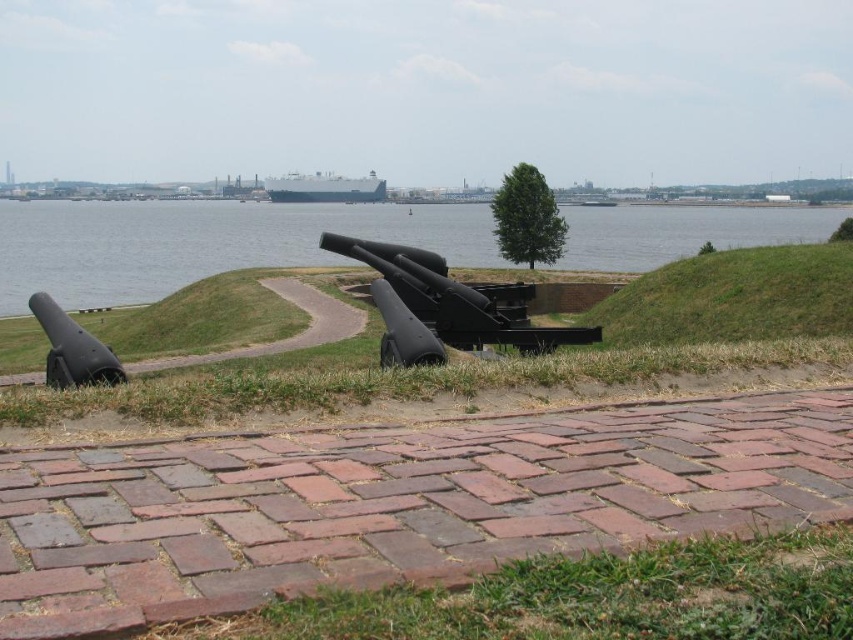
You are a tour guide explaining the layout of the cannons to visitors. You mention the black matte cannon at center and the matte black cannon at left. Which cannon is positioned closer to the brick pathway leading up to them?

The black matte cannon at center is closer to the brick pathway leading up to them because the matte black cannon at left is positioned behind it.

You are a tourist standing at the base of the embankment looking up at the cannons and the water. Which object is closer to you, the blue water at center or the matte black cannon at left?

The matte black cannon at left is closer to you than the blue water at center because the blue water at center is further away in the scene.

You are a historian examining the cannons at the fort. You need to determine which cannon is taller between the black matte cannon at center and the matte black cannon at left. Based on the scene, which one is taller?

The black matte cannon at center is taller than the matte black cannon at left.